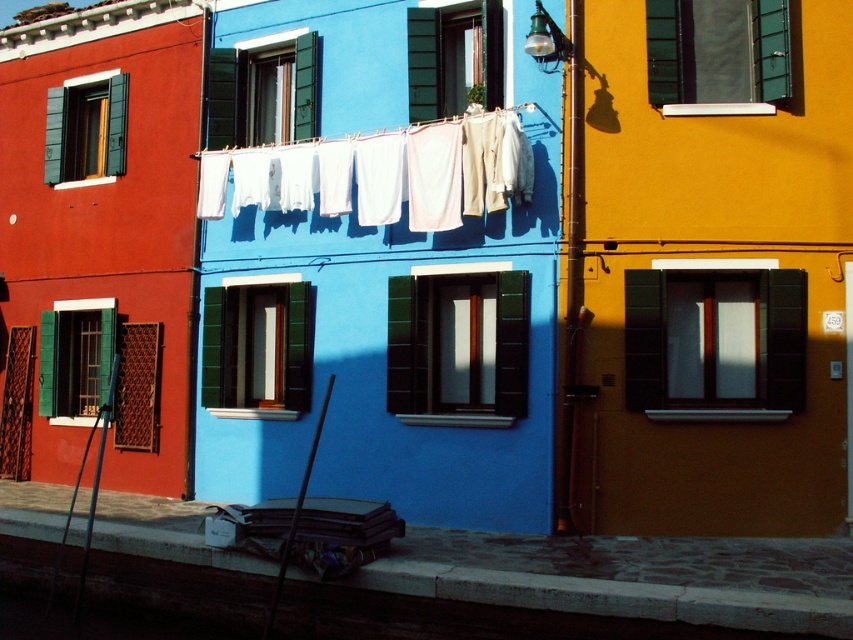
You are a painter standing on a ladder 6 feet tall. You need to paint the green matte shutter at upper left but there are white cotton pants at center hanging in the way. Can you reach the shutter without moving the pants?

The distance between the white cotton pants at center and the green matte shutter at upper left is 10.00 feet. Since the ladder is only 6 feet tall, you cannot reach the shutter without moving the pants.

You are standing in the vibrant street scene with three colored buildings. You notice two points marked on the image at coordinates point (485, 209) and point (77, 136). Which of these points is nearer to you?

Point (485, 209) is closer to the viewer than point (77, 136).